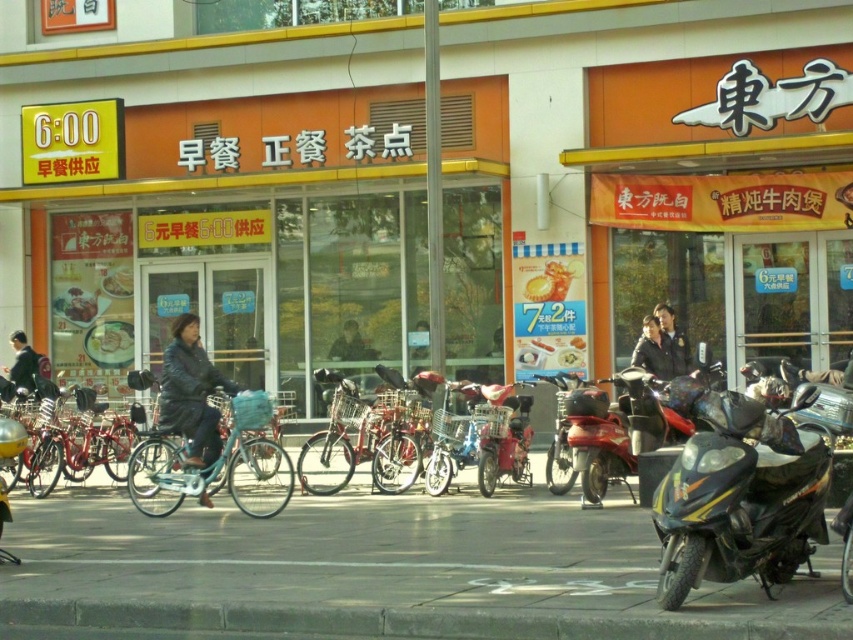
Question: Can you confirm if light blue matte bicycle at center is positioned above dark blue leather jacket at center?

Choices:
 (A) yes
 (B) no

Answer: (B)

Question: Is orange matte signboard at center above shiny metallic bicycle at center?

Choices:
 (A) yes
 (B) no

Answer: (A)

Question: Is shiny black scooter at lower right to the right of dark blue leather jacket at center from the viewer's perspective?

Choices:
 (A) yes
 (B) no

Answer: (A)

Question: Among these objects, which one is nearest to the camera?

Choices:
 (A) metallic red motorcycle at center
 (B) shiny black scooter at lower right
 (C) dark green fabric jacket at center

Answer: (B)

Question: Which point is closer to the camera taking this photo?

Choices:
 (A) (334, 349)
 (B) (695, 371)

Answer: (B)

Question: Which point is closer to the camera taking this photo?

Choices:
 (A) (180, 472)
 (B) (67, 436)

Answer: (A)